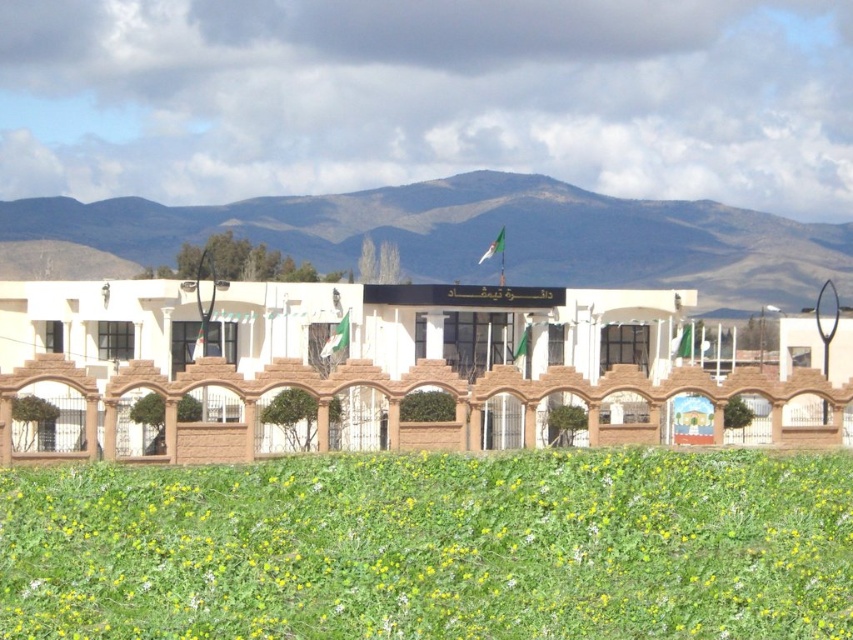
Based on the photo, is brown rocky mountain at upper center below white brick building at center?

Actually, brown rocky mountain at upper center is above white brick building at center.

Who is positioned more to the right, brown rocky mountain at upper center or white brick building at center?

From the viewer's perspective, brown rocky mountain at upper center appears more on the right side.

Image resolution: width=853 pixels, height=640 pixels. What do you see at coordinates (485, 236) in the screenshot?
I see `brown rocky mountain at upper center` at bounding box center [485, 236].

Identify the location of brown rocky mountain at upper center. This screenshot has height=640, width=853. (485, 236).

Looking at this image, does green grass at lower center have a greater width compared to brown rocky mountain at upper center?

In fact, green grass at lower center might be narrower than brown rocky mountain at upper center.

Who is more forward, (x=131, y=618) or (x=688, y=221)?

Point (x=131, y=618) is in front.

The image size is (853, 640). I want to click on green grass at lower center, so click(x=433, y=547).

Between green grass at lower center and white brick building at center, which one appears on the left side from the viewer's perspective?

white brick building at center

Can you confirm if green grass at lower center is wider than white brick building at center?

Incorrect, green grass at lower center's width does not surpass white brick building at center's.

Who is more forward, (724, 636) or (341, 353)?

Point (724, 636) is in front.

Locate an element on the screen. green grass at lower center is located at coordinates (433, 547).